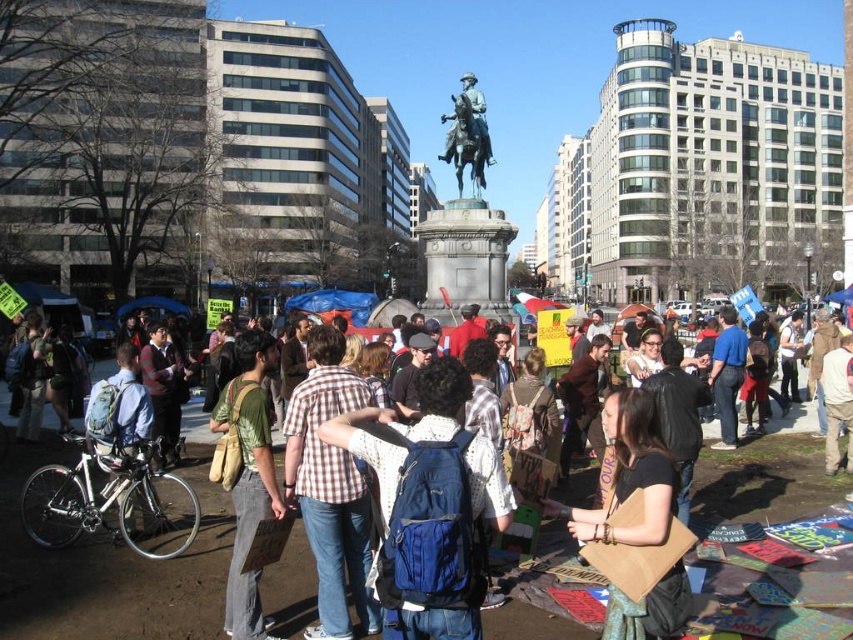
You are attending a public event in the city square and notice two items at the center of the scene. Which item takes up more visual space, the plaid shirt at center or the brown leather bag at center?

The plaid shirt at center has a larger size compared to the brown leather bag at center, so the plaid shirt at center takes up more visual space.